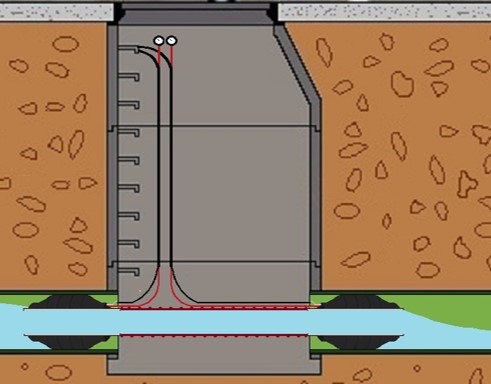
This screenshot has width=491, height=384. I want to click on taps, so click(132, 265), click(125, 242), click(124, 211), click(123, 186), click(123, 157), click(123, 128), click(124, 102), click(125, 74), click(126, 47).